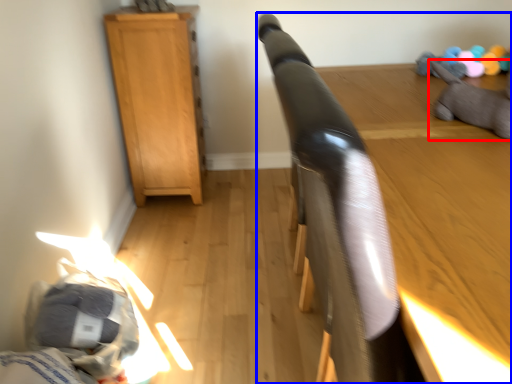
Question: Which object appears closest to the camera in this image, animal (highlighted by a red box) or furniture (highlighted by a blue box)?

Choices:
 (A) animal
 (B) furniture

Answer: (B)